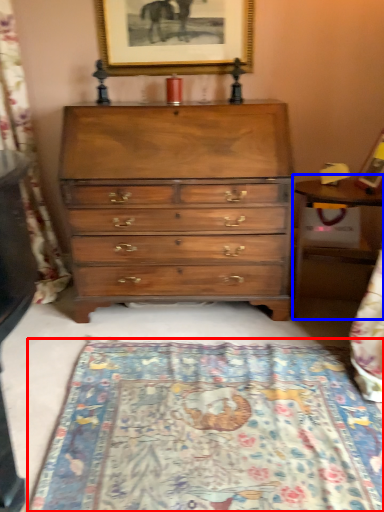
Question: Which of the following is the closest to the observer, mat (highlighted by a red box) or table (highlighted by a blue box)?

Choices:
 (A) mat
 (B) table

Answer: (A)